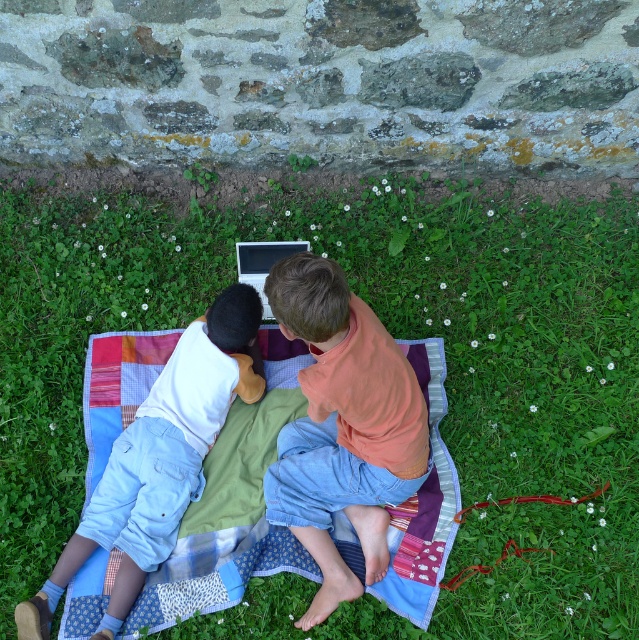
You are a drone operator trying to capture a photo of the children on the blanket. The drone is currently hovering at point coordinates of 0.4, 0.6. To get the best shot, you need to adjust the drone to the same horizontal level as the green grass at center. Should you move the drone up or down?

The green grass at center is located at point coordinates of (x=392, y=333). Since the drone is at (x=383, y=256), the vertical coordinate is 0.6 versus 0.615. The horizontal level refers to the y coordinate. The drone needs to move up slightly to match the y coordinate of 0.615. So move the drone up.

You are a drone operator trying to capture a photo of the orange cotton shirt at center and the green grass at center. The camera has a minimum focus distance of 24 inches. Will you be able to focus on both objects simultaneously?

The distance between the green grass at center and the orange cotton shirt at center is 23.23 inches, which is less than the camera minimum focus distance of 24 inches. Therefore, the camera cannot focus on both objects simultaneously.